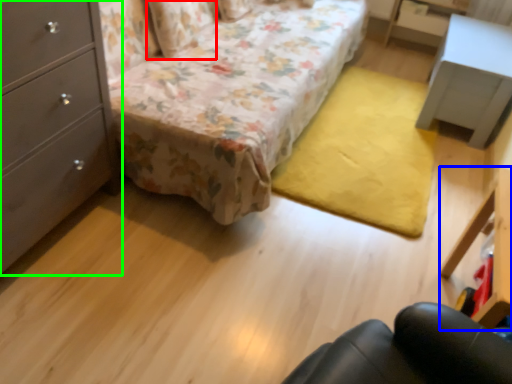
Question: Which object is positioned farthest from pillow (highlighted by a red box)? Select from vanity (highlighted by a blue box) and chest of drawers (highlighted by a green box).

Choices:
 (A) vanity
 (B) chest of drawers

Answer: (A)